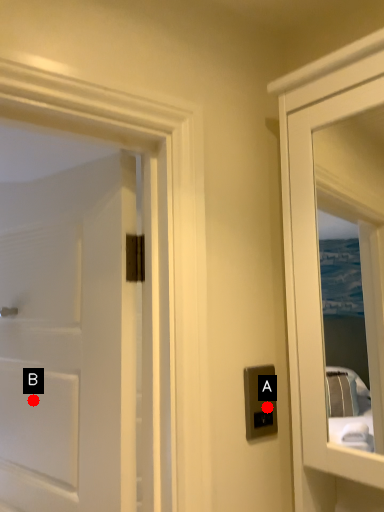
Question: Two points are circled on the image, labeled by A and B beside each circle. Among these points, which one is nearest to the camera?

Choices:
 (A) A is closer
 (B) B is closer

Answer: (A)